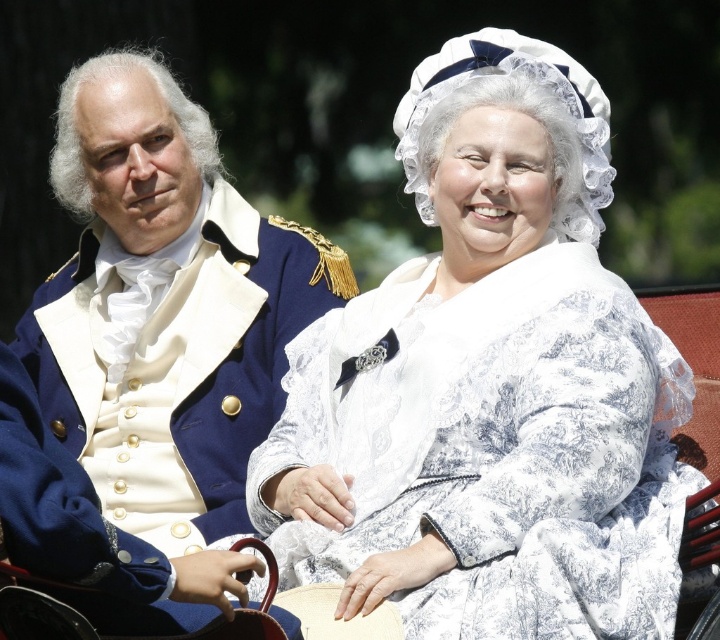
You are a photographer positioned in front of the carriage scene. You need to capture a closeup shot of the white lace dress at center and the blue wool coat at left. Which one should you focus on first to ensure it is in sharp focus?

The white lace dress at center is further to the viewer than the blue wool coat at left, so you should focus on the white lace dress at center first to ensure it is in sharp focus since it is closer to the camera.

You are a photographer standing 5 meters away from the carriage. You want to capture a photo of both the white lace dress at center and the blue wool coat at left in the same frame. Given that your camera has a maximum focal length that allows capturing objects up to 6 meters apart, will you be able to include both subjects in the photo?

The white lace dress at center and blue wool coat at left are 6.14 meters apart from each other. Since the camera can only capture objects up to 6 meters apart, the distance between them exceeds the camera capabilities. Therefore, you won not be able to include both subjects in the photo.

In the scene shown: You are an interior designer planning to place a decorative item between the white lace dress at center and the blue wool coat at left in the carriage. Based on their positions, where should you position the item to ensure it is between them?

The white lace dress at center is below the blue wool coat at left, so placing the decorative item between them would require positioning it below the blue wool coat at left and above the white lace dress at center.